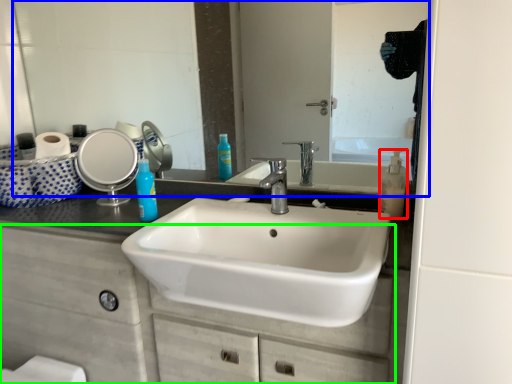
Question: Which is farther away from soap dispenser (highlighted by a red box)? mirror (highlighted by a blue box) or bathroom cabinet (highlighted by a green box)?

Choices:
 (A) mirror
 (B) bathroom cabinet

Answer: (B)